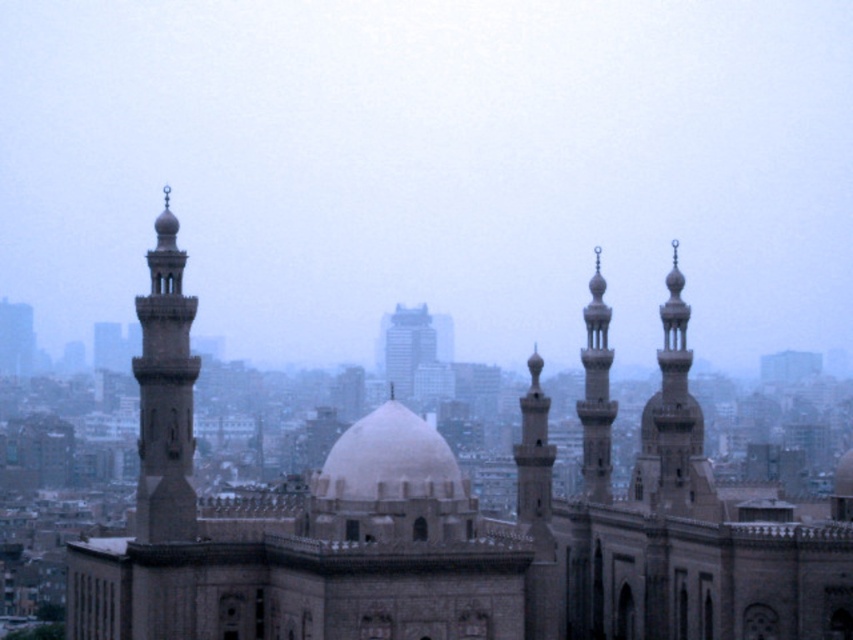
Question: Which point is closer to the camera taking this photo?

Choices:
 (A) (589, 486)
 (B) (144, 500)
 (C) (676, 340)
 (D) (399, 364)

Answer: (B)

Question: Is smooth stone minaret at upper right above white stone dome at center?

Choices:
 (A) no
 (B) yes

Answer: (B)

Question: Considering the relative positions of smooth stone minaret at upper right and smooth stone minaret at center in the image provided, where is smooth stone minaret at upper right located with respect to smooth stone minaret at center?

Choices:
 (A) above
 (B) below

Answer: (A)

Question: Which of the following is the closest to the observer?

Choices:
 (A) white glass skyscraper at center
 (B) smooth stone minaret at upper right
 (C) white stone dome at center
 (D) gray stone minaret at left

Answer: (D)

Question: Is gray stone minaret at left to the left of white glass skyscraper at center from the viewer's perspective?

Choices:
 (A) yes
 (B) no

Answer: (A)

Question: Among these objects, which one is farthest from the camera?

Choices:
 (A) white glass skyscraper at center
 (B) smooth stone minaret at upper right

Answer: (A)